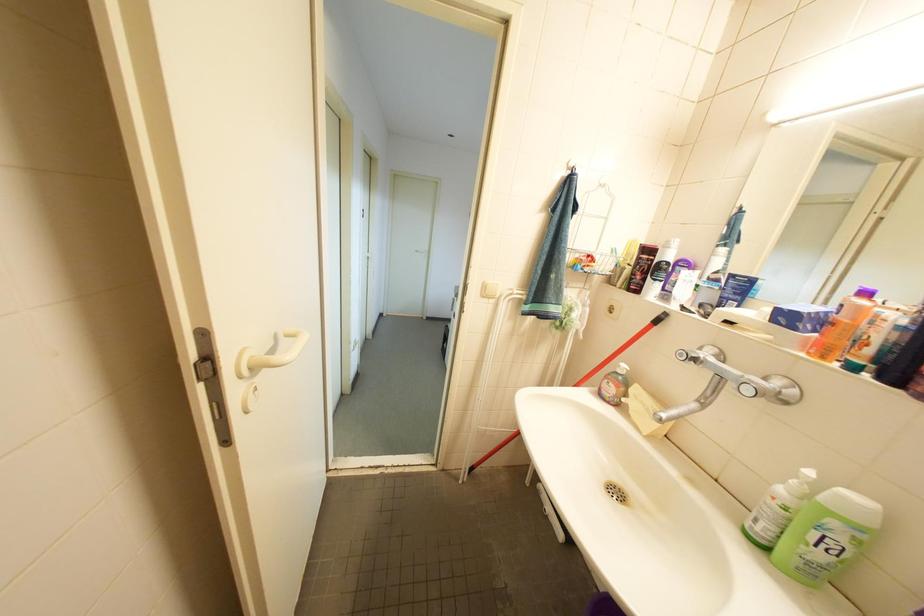
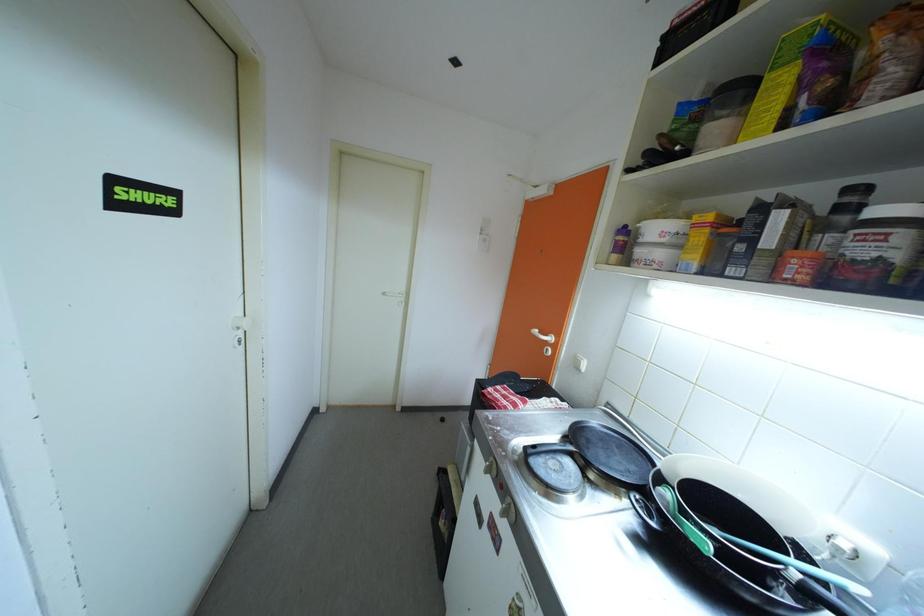
Question: What movement of the cameraman would produce the second image?

Choices:
 (A) Left
 (B) Right
 (C) Forward
 (D) Backward

Answer: (C)